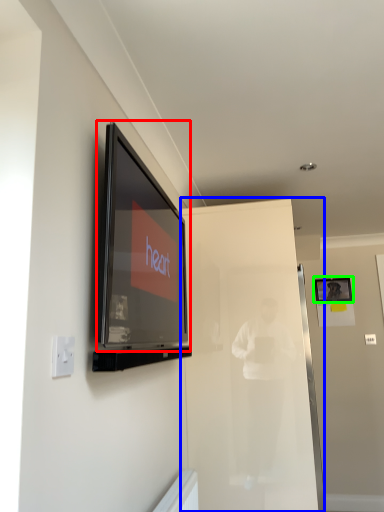
Question: Considering the real-world distances, which object is farthest from television (highlighted by a red box)? glass door (highlighted by a blue box) or picture frame (highlighted by a green box)?

Choices:
 (A) glass door
 (B) picture frame

Answer: (B)